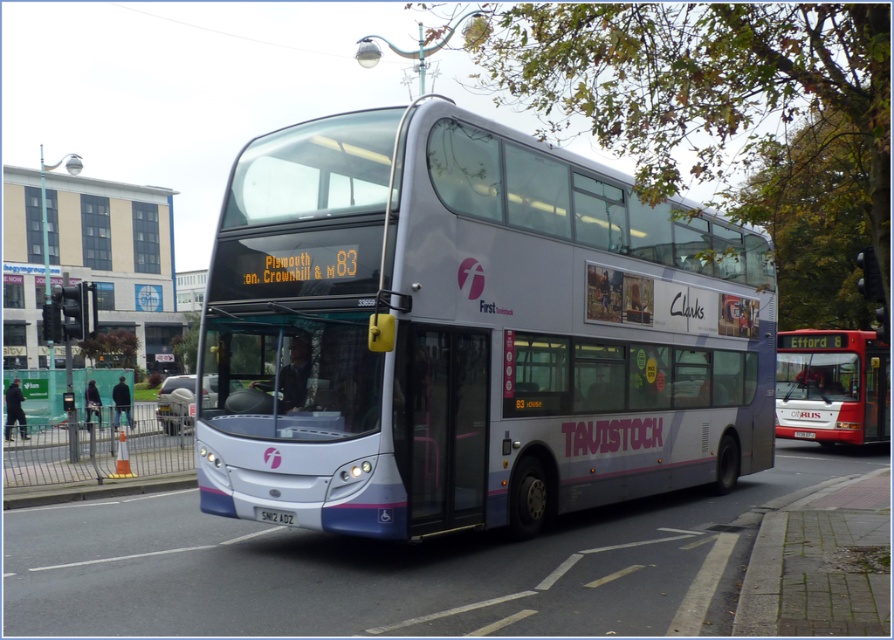
Consider the image. Is red matte bus at center to the right of white plastic license plate at center from the viewer's perspective?

Yes, red matte bus at center is to the right of white plastic license plate at center.

Does red matte bus at center appear under white plastic license plate at center?

Incorrect, red matte bus at center is not positioned below white plastic license plate at center.

Does point (789, 419) lie in front of point (262, 509)?

No, it is behind (262, 509).

Where is `red matte bus at center`? The height and width of the screenshot is (640, 894). red matte bus at center is located at coordinates (832, 387).

Who is more forward, (200, 420) or (871, 360)?

Point (200, 420) is in front.

Describe the element at coordinates (468, 332) in the screenshot. The height and width of the screenshot is (640, 894). I see `silver metallic bus at center` at that location.

From the picture: Who is more forward, (342, 131) or (869, 344)?

Point (342, 131) is more forward.

Locate an element on the screen. silver metallic bus at center is located at coordinates (468, 332).

How much distance is there between silver metallic bus at center and white plastic license plate at center?

13.02 feet

Is silver metallic bus at center closer to camera compared to white plastic license plate at center?

Yes.

Locate an element on the screen. This screenshot has width=894, height=640. silver metallic bus at center is located at coordinates (468, 332).